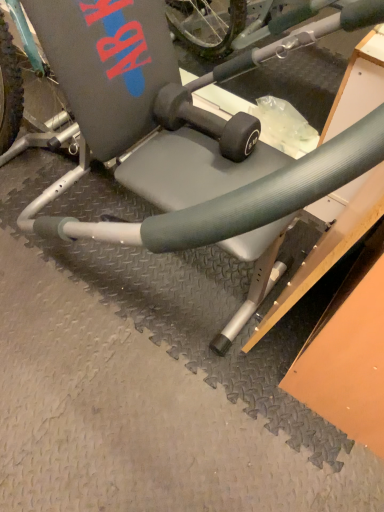
What is the approximate height of teal matte bicycle at upper left?

The height of teal matte bicycle at upper left is 38.07 inches.

Describe the element at coordinates (185, 131) in the screenshot. I see `teal matte bicycle at upper left` at that location.

Find the location of a particular element. teal matte bicycle at upper left is located at coordinates (185, 131).

This screenshot has height=512, width=384. I want to click on teal matte bicycle at upper left, so click(x=185, y=131).